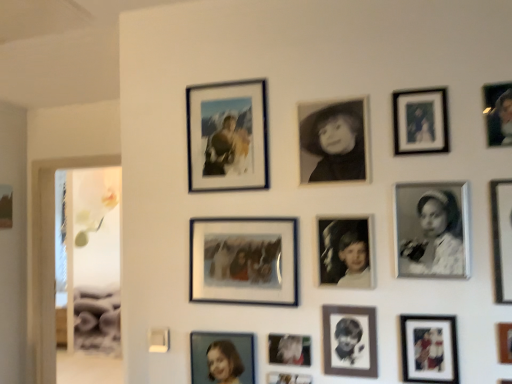
Where is `metallic silver photo frame at lower center, acting as the fifth picture frame starting from the back`? metallic silver photo frame at lower center, acting as the fifth picture frame starting from the back is located at coordinates (289, 349).

How much space does metallic silver picture frame at right, which ranks as the 14th picture frame in back-to-front order, occupy horizontally?

metallic silver picture frame at right, which ranks as the 14th picture frame in back-to-front order, is 1.07 inches wide.

Measure the distance between point (x=357, y=150) and camera.

1.50 meters.

This screenshot has height=384, width=512. What are the coordinates of `matte black photo frame at upper right, which is the 10th picture frame from left to right` in the screenshot? It's located at (420, 121).

Where is `black paper portrait at center, the 6th picture frame in the right-to-left sequence`? black paper portrait at center, the 6th picture frame in the right-to-left sequence is located at coordinates click(350, 341).

Does point (438, 261) appear closer or farther from the camera than point (408, 372)?

Point (438, 261) appears to be closer to the viewer than point (408, 372).

Choose the correct answer: Is black matte photo frame at center-right, which ranks as the 3th picture frame in right-to-left order, inside matte black photo frame at lower right, placed as the 3th picture frame when sorted from front to back, or outside it?

black matte photo frame at center-right, which ranks as the 3th picture frame in right-to-left order, is located beyond the bounds of matte black photo frame at lower right, placed as the 3th picture frame when sorted from front to back.

Between black matte photo frame at center-right, the 12th picture frame when ordered from left to right, and matte black photo frame at lower right, marked as the fourth picture frame in a right-to-left arrangement, which one is positioned in front?

matte black photo frame at lower right, marked as the fourth picture frame in a right-to-left arrangement, is in front.

In the image, is black matte photo frame at center-right, the 12th picture frame when ordered from left to right, on the left side or the right side of matte black photo frame at lower right, placed as the twelfth picture frame when sorted from back to front?

black matte photo frame at center-right, the 12th picture frame when ordered from left to right, is positioned on matte black photo frame at lower right, placed as the twelfth picture frame when sorted from back to front,'s right side.

Considering the sizes of objects metallic silver photo frame at lower center, the sixth picture frame in the back-to-front sequence, and black matte portrait at center, which appears as the 8th picture frame when viewed from the right, in the image provided, who is shorter, metallic silver photo frame at lower center, the sixth picture frame in the back-to-front sequence, or black matte portrait at center, which appears as the 8th picture frame when viewed from the right,?

Standing shorter between the two is metallic silver photo frame at lower center, the sixth picture frame in the back-to-front sequence.

Relative to black matte portrait at center, the eighth picture frame positioned from the front, is metallic silver photo frame at lower center, which is counted as the 9th picture frame, starting from the front, in front or behind?

Clearly, metallic silver photo frame at lower center, which is counted as the 9th picture frame, starting from the front, is behind black matte portrait at center, the eighth picture frame positioned from the front.

Can you confirm if metallic silver photo frame at lower center, the ninth picture frame when ordered from right to left, is smaller than black matte portrait at center, arranged as the seventh picture frame when viewed from the left?

Yes, metallic silver photo frame at lower center, the ninth picture frame when ordered from right to left, is smaller than black matte portrait at center, arranged as the seventh picture frame when viewed from the left.

Is metallic silver photo frame at lower center, positioned as the 6th picture frame in left-to-right order, beside black matte portrait at center, the 7th picture frame viewed from the back?

metallic silver photo frame at lower center, positioned as the 6th picture frame in left-to-right order, and black matte portrait at center, the 7th picture frame viewed from the back, are not in contact.

Find the location of a particular element. The width and height of the screenshot is (512, 384). the 12th picture frame to the left when counting from the metallic silver picture frame at right, which is the first picture frame in right-to-left order is located at coordinates (222, 357).

Which object is wider, matte blue photo frame at lower center, acting as the 3th picture frame starting from the back, or metallic silver picture frame at right, which ranks as the 14th picture frame in back-to-front order?

metallic silver picture frame at right, which ranks as the 14th picture frame in back-to-front order, is wider.

From the image's perspective, between matte blue photo frame at lower center, the second picture frame viewed from the left, and metallic silver picture frame at right, which is the first picture frame in right-to-left order, which one is located above?

metallic silver picture frame at right, which is the first picture frame in right-to-left order, appears higher in the image.

Is matte blue photo frame at lower center, which appears as the 12th picture frame when viewed from the front, facing away from metallic silver picture frame at right, which is the first picture frame from front to back?

No, matte blue photo frame at lower center, which appears as the 12th picture frame when viewed from the front, is not facing the opposite direction of metallic silver picture frame at right, which is the first picture frame from front to back.

From the metallic silver photo frame at lower center, which is the 10th picture frame in right-to-left order, count 1st picture frames forward and point to it. Please provide its 2D coordinates.

[(288, 378)]

Is metallic silver photo frame at lower center, the sixth picture frame in the back-to-front sequence, at the back of metallic silver photo frame at lower center, which is the 10th picture frame in right-to-left order?

No, metallic silver photo frame at lower center, which is the 10th picture frame in right-to-left order, is not facing the opposite direction of metallic silver photo frame at lower center, the sixth picture frame in the back-to-front sequence.

From a real-world perspective, who is located lower, metallic silver photo frame at lower center, the 5th picture frame positioned from the left, or metallic silver photo frame at lower center, the ninth picture frame when ordered from right to left?

metallic silver photo frame at lower center, the ninth picture frame when ordered from right to left, is physically lower.

Does point (509, 125) come behind point (509, 293)?

Yes.

Considering the relative sizes of matte black portrait at upper right, which appears as the second picture frame when viewed from the right, and metallic silver picture frame at right, which ranks as the 14th picture frame in back-to-front order, in the image provided, is matte black portrait at upper right, which appears as the second picture frame when viewed from the right, wider than metallic silver picture frame at right, which ranks as the 14th picture frame in back-to-front order,?

No, matte black portrait at upper right, which appears as the second picture frame when viewed from the right, is not wider than metallic silver picture frame at right, which ranks as the 14th picture frame in back-to-front order.

Does matte black portrait at upper right, which appears as the second picture frame when viewed from the right, turn towards metallic silver picture frame at right, which is the fourteenth picture frame from left to right?

No.

Is matte black portrait at upper right, the second picture frame viewed from the front, to the left or to the right of metallic silver picture frame at right, which is the fourteenth picture frame from left to right, in the image?

Based on their positions, matte black portrait at upper right, the second picture frame viewed from the front, is located to the left of metallic silver picture frame at right, which is the fourteenth picture frame from left to right.

Which is in front, point (422, 92) or point (354, 245)?

The point (422, 92) is more forward.

From a real-world perspective, relative to black matte photo at center, which is the 8th picture frame from back to front, is matte black photo frame at upper right, the fifth picture frame when ordered from front to back, vertically above or below?

In terms of real-world spatial position, matte black photo frame at upper right, the fifth picture frame when ordered from front to back, is above black matte photo at center, which is the 8th picture frame from back to front.

Visually, is matte black photo frame at upper right, the fifth picture frame when ordered from front to back, positioned to the left or to the right of black matte photo at center, placed as the eighth picture frame when sorted from left to right?

matte black photo frame at upper right, the fifth picture frame when ordered from front to back, is positioned on black matte photo at center, placed as the eighth picture frame when sorted from left to right,'s right side.

Does matte black photo frame at upper right, which is the 10th picture frame from left to right, touch black matte photo at center, the 7th picture frame viewed from the front?

matte black photo frame at upper right, which is the 10th picture frame from left to right, and black matte photo at center, the 7th picture frame viewed from the front, are clearly separated.

Is black matte portrait at center, which appears as the 8th picture frame when viewed from the right, located within matte black photo frame at left, the 1th picture frame viewed from the back?

No.

Based on the photo, is matte black photo frame at left, the 1th picture frame viewed from the back, aimed at black matte portrait at center, arranged as the seventh picture frame when viewed from the left?

Yes, matte black photo frame at left, the 1th picture frame viewed from the back, is facing black matte portrait at center, arranged as the seventh picture frame when viewed from the left.

Considering the positions of objects matte black photo frame at left, acting as the fourteenth picture frame starting from the right, and black matte portrait at center, which appears as the 8th picture frame when viewed from the right, in the image provided, who is more to the right, matte black photo frame at left, acting as the fourteenth picture frame starting from the right, or black matte portrait at center, which appears as the 8th picture frame when viewed from the right,?

Positioned to the right is black matte portrait at center, which appears as the 8th picture frame when viewed from the right.

From the image's perspective, is matte black photo frame at left, which is counted as the first picture frame, starting from the left, over black matte portrait at center, the eighth picture frame positioned from the front?

No, from the image's perspective, matte black photo frame at left, which is counted as the first picture frame, starting from the left, is not above black matte portrait at center, the eighth picture frame positioned from the front.

Find the location of a particular element. Image resolution: width=512 pixels, height=384 pixels. the 1st picture frame in front of the black matte photo frame at center-right, the 12th picture frame when ordered from left to right is located at coordinates (429, 349).

What are the coordinates of `the 10th picture frame positioned below the black matte portrait at center, the eighth picture frame positioned from the front (from a real-world perspective)` in the screenshot? It's located at (288, 378).

From the image, which object appears to be nearer to black matte portrait at center, which appears as the 8th picture frame when viewed from the right, matte black photo frame at left, acting as the fourteenth picture frame starting from the right, or matte glass photo frame at upper center, the 12th picture frame from the right?

matte glass photo frame at upper center, the 12th picture frame from the right, is positioned closer to the anchor black matte portrait at center, which appears as the 8th picture frame when viewed from the right.

Estimate the real-world distances between objects in this image. Which object is further from matte black photo frame at upper right, which is the 10th picture frame from left to right, matte black portrait at upper right, which appears as the second picture frame when viewed from the right, or matte glass photo frame at upper center, which is counted as the 2th picture frame, starting from the back?

matte glass photo frame at upper center, which is counted as the 2th picture frame, starting from the back, lies further to matte black photo frame at upper right, which is the 10th picture frame from left to right, than the other object.

Consider the image. Considering their positions, is matte blue photo frame at lower center, acting as the thirteenth picture frame starting from the right, positioned further to black matte photo frame at center-right, the 12th picture frame when ordered from left to right, than metallic silver photo frame at lower center, acting as the fifth picture frame starting from the back?

matte blue photo frame at lower center, acting as the thirteenth picture frame starting from the right.

Looking at the image, which one is located closer to matte blue photo frame at lower center, which appears as the 12th picture frame when viewed from the front, metallic silver photo frame at lower center, which is counted as the 9th picture frame, starting from the front, or matte black photo frame at left, acting as the fourteenth picture frame starting from the right?

The object closer to matte blue photo frame at lower center, which appears as the 12th picture frame when viewed from the front, is metallic silver photo frame at lower center, which is counted as the 9th picture frame, starting from the front.

Estimate the real-world distances between objects in this image. Which object is further from metallic silver photo frame at lower center, the sixth picture frame in the back-to-front sequence, matte glass photo frame at center, placed as the 4th picture frame when sorted from left to right, or black paper portrait at center, which is counted as the 9th picture frame, starting from the left?

The object further to metallic silver photo frame at lower center, the sixth picture frame in the back-to-front sequence, is matte glass photo frame at center, placed as the 4th picture frame when sorted from left to right.

From the image, which object appears to be nearer to metallic silver picture frame at right, which is the fourteenth picture frame from left to right, matte black photo frame at upper right, which is the tenth picture frame in back-to-front order, or black paper portrait at center, which is the 9th picture frame from back to front?

matte black photo frame at upper right, which is the tenth picture frame in back-to-front order.

Considering their positions, is metallic silver photo frame at lower center, the ninth picture frame when ordered from right to left, positioned further to matte black portrait at upper right, which appears as the second picture frame when viewed from the right, than metallic silver photo frame at lower center, which is the 10th picture frame in right-to-left order?

metallic silver photo frame at lower center, the ninth picture frame when ordered from right to left, lies further to matte black portrait at upper right, which appears as the second picture frame when viewed from the right, than the other object.

Looking at this image, from the image, which object appears to be farther from metallic silver picture frame at right, which is the first picture frame from front to back, black matte photo at center, the 7th picture frame from the right, or matte glass photo frame at center, the eleventh picture frame in the front-to-back sequence?

Among the two, matte glass photo frame at center, the eleventh picture frame in the front-to-back sequence, is located further to metallic silver picture frame at right, which is the first picture frame from front to back.

Find the location of a particular element. picture frame situated between matte black photo frame at left, acting as the fourteenth picture frame starting from the right, and matte glass photo frame at upper center, the thirteenth picture frame positioned from the front, from left to right is located at coordinates (222, 357).